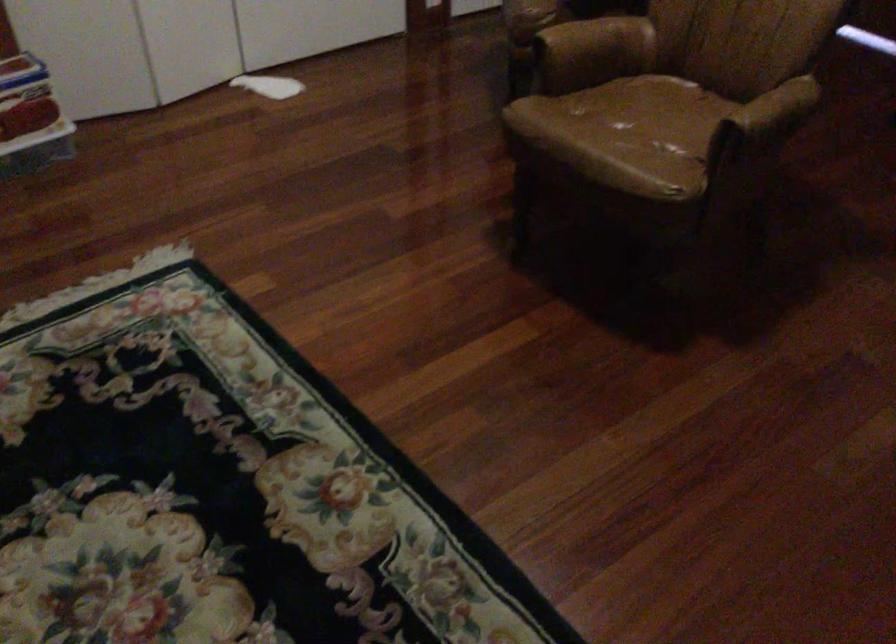
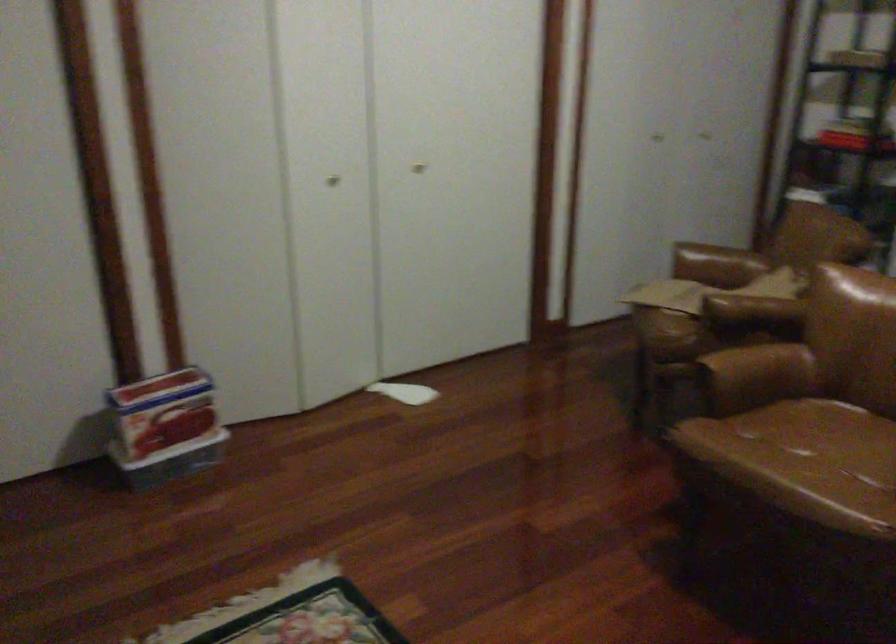
Question: What movement of the cameraman would produce the second image?

Choices:
 (A) Left
 (B) Right
 (C) Forward
 (D) Backward

Answer: (A)